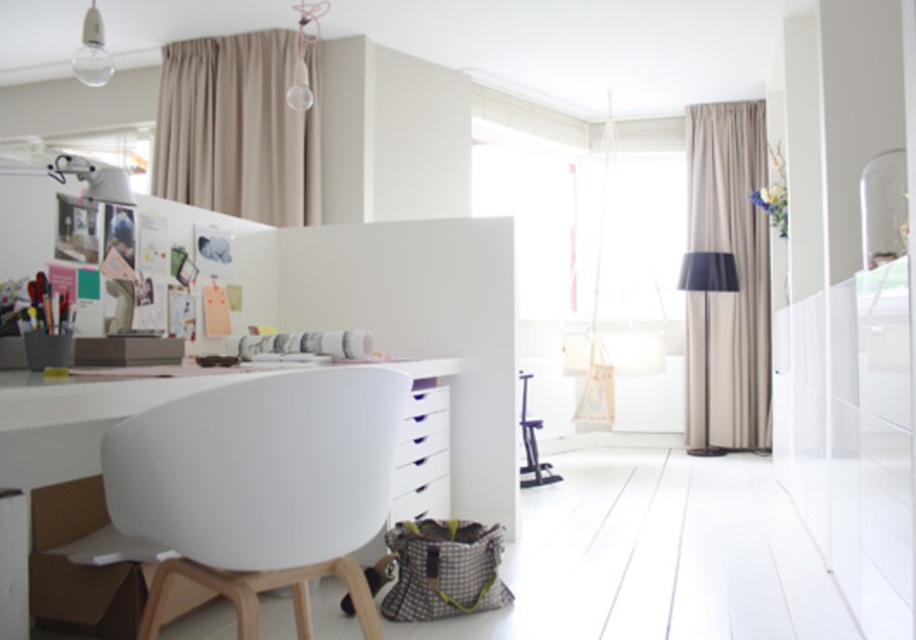
You are organizing your home office and need to place a new item on the desk. Given the white glossy drawer at center and the metallic stool at center, which object should you place the item on if you want to use the larger surface area?

The metallic stool at center has a larger surface area than the white glossy drawer at center, so you should place the item on the metallic stool at center.

Consider the image. You are a person who is 1.7 meters tall and wants to move from the beige fabric curtain at right to the metallic stool at center. Can you walk directly between them without bending or ducking?

The distance between the beige fabric curtain at right and the metallic stool at center is 1.96 meters, which is more than enough for a person of 1.7 meters to walk between them without needing to bend or duck since the height of the person is unrelated to the horizontal distance between the objects.